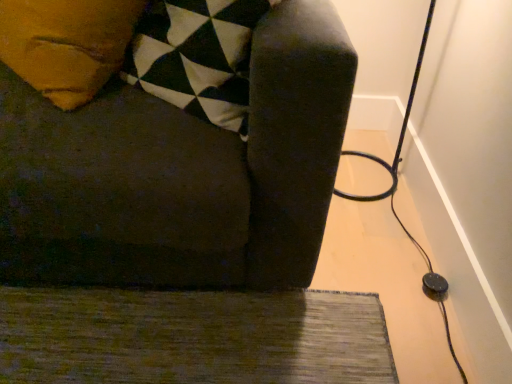
The image size is (512, 384). What do you see at coordinates (395, 191) in the screenshot?
I see `black rubber cable at right` at bounding box center [395, 191].

Where is `green textured rug at lower left`? This screenshot has width=512, height=384. green textured rug at lower left is located at coordinates (192, 337).

How many degrees apart are the facing directions of dark fabric couch at center and green textured rug at lower left?

There is a 91.4-degree angle between the facing directions of dark fabric couch at center and green textured rug at lower left.

Find the location of a particular element. furniture in front of the green textured rug at lower left is located at coordinates (181, 172).

Can you see dark fabric couch at center touching green textured rug at lower left?

No, dark fabric couch at center is not next to green textured rug at lower left.

Could you tell me if dark fabric couch at center is facing green textured rug at lower left?

Yes, dark fabric couch at center is aimed at green textured rug at lower left.

Is dark fabric couch at center turned away from black rubber cable at right?

No, black rubber cable at right is not at the back of dark fabric couch at center.

From the image's perspective, does dark fabric couch at center appear higher than black rubber cable at right?

Actually, dark fabric couch at center appears below black rubber cable at right in the image.

From a real-world perspective, is dark fabric couch at center over black rubber cable at right?

Yes.

From their relative heights in the image, would you say dark fabric couch at center is taller or shorter than black rubber cable at right?

Considering their sizes, dark fabric couch at center has more height than black rubber cable at right.

From a real-world perspective, is green textured rug at lower left on black rubber cable at right?

Actually, green textured rug at lower left is physically below black rubber cable at right in the real world.

From the image's perspective, relative to black rubber cable at right, is green textured rug at lower left above or below?

Clearly, from the image's perspective, green textured rug at lower left is below black rubber cable at right.

Between green textured rug at lower left and black rubber cable at right, which one has less height?

green textured rug at lower left.

Can you confirm if green textured rug at lower left is thinner than black rubber cable at right?

No.

From a real-world perspective, which is physically below, black rubber cable at right or dark fabric couch at center?

In real-world perspective, black rubber cable at right is lower.

Is black rubber cable at right outside of dark fabric couch at center?

Yes, black rubber cable at right is located beyond the bounds of dark fabric couch at center.

Is point (381, 197) farther from viewer compared to point (256, 220)?

Yes, point (381, 197) is farther from viewer.

From their relative heights in the image, would you say black rubber cable at right is taller or shorter than dark fabric couch at center?

black rubber cable at right is shorter than dark fabric couch at center.

Does black rubber cable at right lie behind green textured rug at lower left?

Yes, it is.

Considering the positions of objects black rubber cable at right and green textured rug at lower left in the image provided, who is more to the left, black rubber cable at right or green textured rug at lower left?

green textured rug at lower left is more to the left.

From the image's perspective, would you say black rubber cable at right is shown under green textured rug at lower left?

No, from the image's perspective, black rubber cable at right is not beneath green textured rug at lower left.

Is the depth of green textured rug at lower left greater than that of dark fabric couch at center?

Yes, it is.

Identify the location of furniture that is above the green textured rug at lower left (from the image's perspective). (181, 172).

Is point (296, 296) closer to viewer compared to point (307, 11)?

No, (296, 296) is behind (307, 11).

Locate an element on the screen. furniture that is above the green textured rug at lower left (from a real-world perspective) is located at coordinates (181, 172).

Find the location of a particular element. furniture lying below the black rubber cable at right (from the image's perspective) is located at coordinates (181, 172).

Looking at the image, which one is located closer to green textured rug at lower left, black rubber cable at right or dark fabric couch at center?

dark fabric couch at center lies closer to green textured rug at lower left than the other object.

From the image, which object appears to be nearer to dark fabric couch at center, green textured rug at lower left or black rubber cable at right?

green textured rug at lower left is closer to dark fabric couch at center.

Which object lies further to the anchor point green textured rug at lower left, dark fabric couch at center or black rubber cable at right?

Based on the image, black rubber cable at right appears to be further to green textured rug at lower left.

Which object lies nearer to the anchor point black rubber cable at right, green textured rug at lower left or dark fabric couch at center?

Among the two, green textured rug at lower left is located nearer to black rubber cable at right.

From the image, which object appears to be farther from black rubber cable at right, dark fabric couch at center or green textured rug at lower left?

Among the two, dark fabric couch at center is located further to black rubber cable at right.

When comparing their distances from dark fabric couch at center, does black rubber cable at right or green textured rug at lower left seem further?

The object further to dark fabric couch at center is black rubber cable at right.

Locate an element on the screen. doormat between dark fabric couch at center and black rubber cable at right is located at coordinates (192, 337).